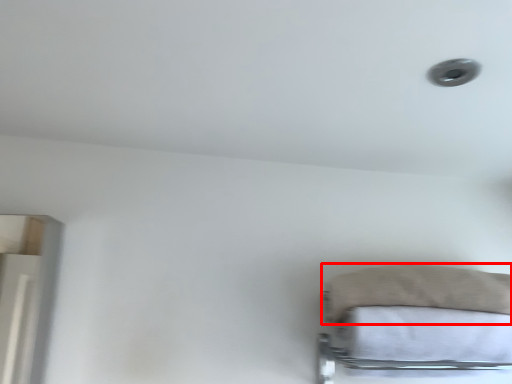
Question: From the image's perspective, considering the relative positions of pillow (annotated by the red box) and sheet in the image provided, where is pillow (annotated by the red box) located with respect to the staircase?

Choices:
 (A) above
 (B) below

Answer: (A)